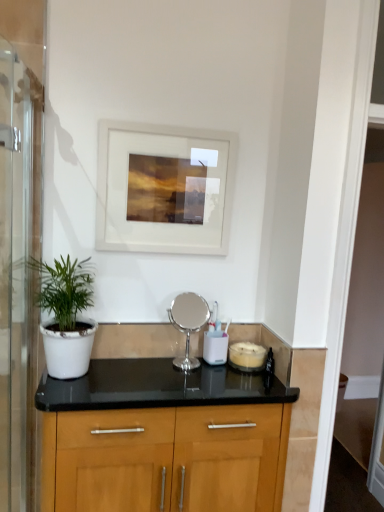
Question: Is transparent glass screen door at left bigger than white matte picture frame at upper center?

Choices:
 (A) yes
 (B) no

Answer: (A)

Question: From the image's perspective, would you say transparent glass screen door at left is shown under white matte picture frame at upper center?

Choices:
 (A) no
 (B) yes

Answer: (B)

Question: Can you confirm if transparent glass screen door at left is smaller than white matte picture frame at upper center?

Choices:
 (A) yes
 (B) no

Answer: (B)

Question: Can you confirm if transparent glass screen door at left is positioned to the left of white matte picture frame at upper center?

Choices:
 (A) no
 (B) yes

Answer: (B)

Question: Is transparent glass screen door at left wider than white matte picture frame at upper center?

Choices:
 (A) yes
 (B) no

Answer: (A)

Question: Is point (9, 358) closer or farther from the camera than point (168, 133)?

Choices:
 (A) farther
 (B) closer

Answer: (A)

Question: Relative to white matte picture frame at upper center, is transparent glass screen door at left in front or behind?

Choices:
 (A) behind
 (B) front

Answer: (B)

Question: Is transparent glass screen door at left spatially inside white matte picture frame at upper center, or outside of it?

Choices:
 (A) inside
 (B) outside

Answer: (B)

Question: In terms of size, does transparent glass screen door at left appear bigger or smaller than white matte picture frame at upper center?

Choices:
 (A) small
 (B) big

Answer: (B)

Question: Considering the positions of white matte pot at left and white matte picture frame at upper center in the image, is white matte pot at left taller or shorter than white matte picture frame at upper center?

Choices:
 (A) tall
 (B) short

Answer: (B)

Question: Based on their sizes in the image, would you say white matte pot at left is bigger or smaller than white matte picture frame at upper center?

Choices:
 (A) small
 (B) big

Answer: (B)

Question: From the image's perspective, is white matte pot at left located above or below white matte picture frame at upper center?

Choices:
 (A) below
 (B) above

Answer: (A)

Question: In the image, is white matte pot at left on the left side or the right side of white matte picture frame at upper center?

Choices:
 (A) left
 (B) right

Answer: (A)

Question: Looking at the image, does transparent glass screen door at left seem bigger or smaller compared to white matte pot at left?

Choices:
 (A) big
 (B) small

Answer: (A)

Question: From the image's perspective, relative to white matte pot at left, is transparent glass screen door at left above or below?

Choices:
 (A) below
 (B) above

Answer: (A)